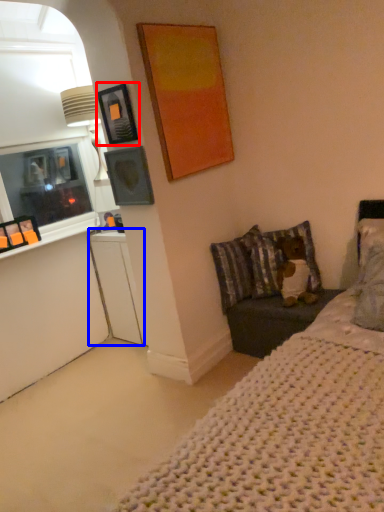
Question: Which point is closer to the camera, picture frame (highlighted by a red box) or dresser (highlighted by a blue box)?

Choices:
 (A) picture frame
 (B) dresser

Answer: (A)